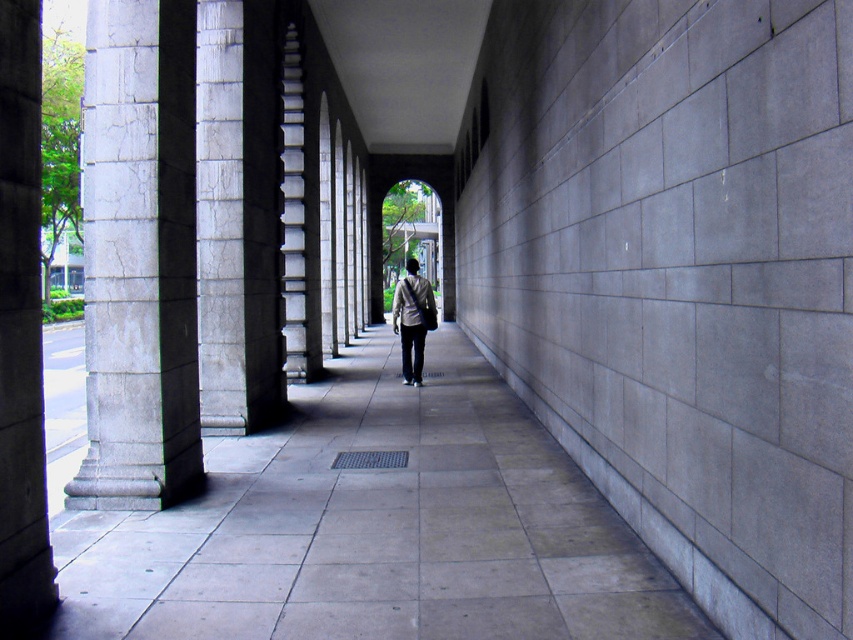
Which of these two, gray concrete pavement at center or gray concrete pillar at left, stands shorter?

With less height is gray concrete pavement at center.

Which is more to the left, gray concrete pavement at center or gray concrete pillar at left?

Positioned to the left is gray concrete pillar at left.

Which is in front, point (141, 636) or point (22, 397)?

Point (141, 636)

Locate an element on the screen. gray concrete pavement at center is located at coordinates (376, 528).

Is gray stone column at left behind gray concrete pillar at left?

Yes, gray stone column at left is further from the viewer.

Identify the location of gray stone column at left. Image resolution: width=853 pixels, height=640 pixels. (138, 257).

Can you confirm if gray stone column at left is taller than light gray fabric jacket at center?

Yes, gray stone column at left is taller than light gray fabric jacket at center.

Does gray stone column at left have a larger size compared to light gray fabric jacket at center?

No, gray stone column at left is not bigger than light gray fabric jacket at center.

At what (x,y) coordinates should I click in order to perform the action: click on gray stone column at left. Please return your answer as a coordinate pair (x, y). The width and height of the screenshot is (853, 640). Looking at the image, I should click on (138, 257).

Where is `gray stone column at left`? gray stone column at left is located at coordinates (138, 257).